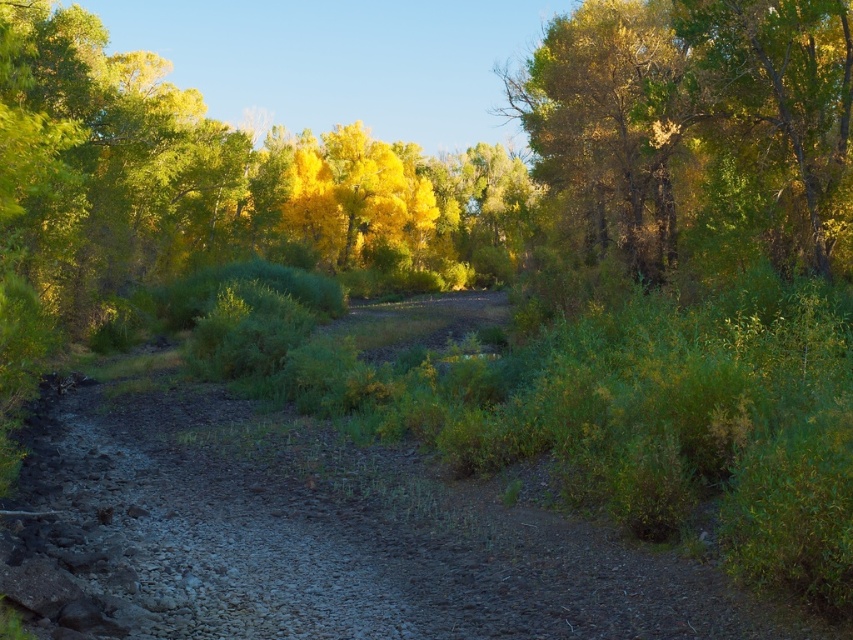
Question: Can you confirm if dull brown dirt track at center is thinner than green leafy tree at upper right?

Choices:
 (A) no
 (B) yes

Answer: (A)

Question: Which point is farther from the camera taking this photo?

Choices:
 (A) (119, 464)
 (B) (733, 156)

Answer: (B)

Question: Can you confirm if dull brown dirt track at center is smaller than green leafy tree at upper right?

Choices:
 (A) yes
 (B) no

Answer: (A)

Question: Does dull brown dirt track at center appear over green leafy tree at upper right?

Choices:
 (A) yes
 (B) no

Answer: (B)

Question: Which object is closer to the camera taking this photo?

Choices:
 (A) green leafy tree at upper right
 (B) dull brown dirt track at center

Answer: (B)

Question: Which point appears closest to the camera in this image?

Choices:
 (A) (161, 449)
 (B) (556, 164)

Answer: (A)